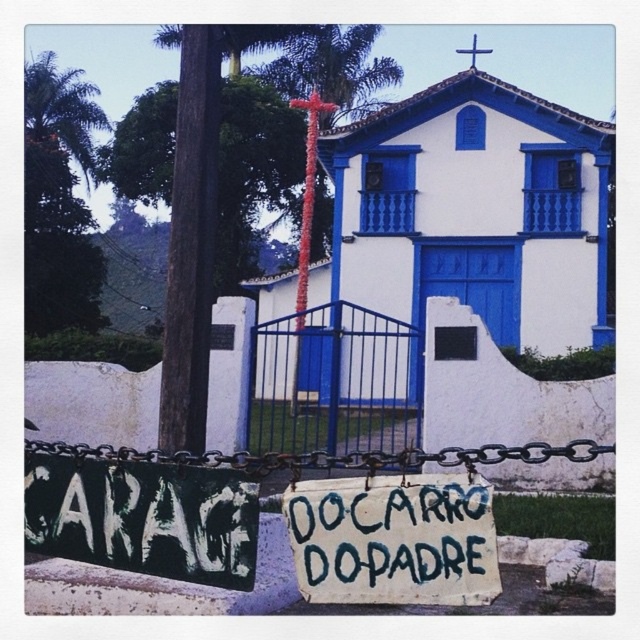
Can you confirm if white painted wood sign at center is positioned to the left of red floral pole at center?

Incorrect, white painted wood sign at center is not on the left side of red floral pole at center.

Who is higher up, white painted wood sign at center or red floral pole at center?

red floral pole at center is above.

Who is more forward, [458,536] or [323,109]?

Point [458,536]

The height and width of the screenshot is (640, 640). Identify the location of white painted wood sign at center. click(394, 541).

How much distance is there between metallic blue gate at center and red floral pole at center?

metallic blue gate at center and red floral pole at center are 7.31 feet apart from each other.

Who is taller, metallic blue gate at center or red floral pole at center?

Standing taller between the two is red floral pole at center.

Between point (358, 403) and point (298, 300), which one is positioned behind?

Point (358, 403)

At what (x,y) coordinates should I click in order to perform the action: click on metallic blue gate at center. Please return your answer as a coordinate pair (x, y). Looking at the image, I should click on (333, 381).

Is white painted wood church at center further to camera compared to metallic blue gate at center?

Yes, it is.

Between white painted wood church at center and metallic blue gate at center, which one appears on the right side from the viewer's perspective?

From the viewer's perspective, white painted wood church at center appears more on the right side.

The image size is (640, 640). What are the coordinates of `white painted wood church at center` in the screenshot? It's located at (474, 211).